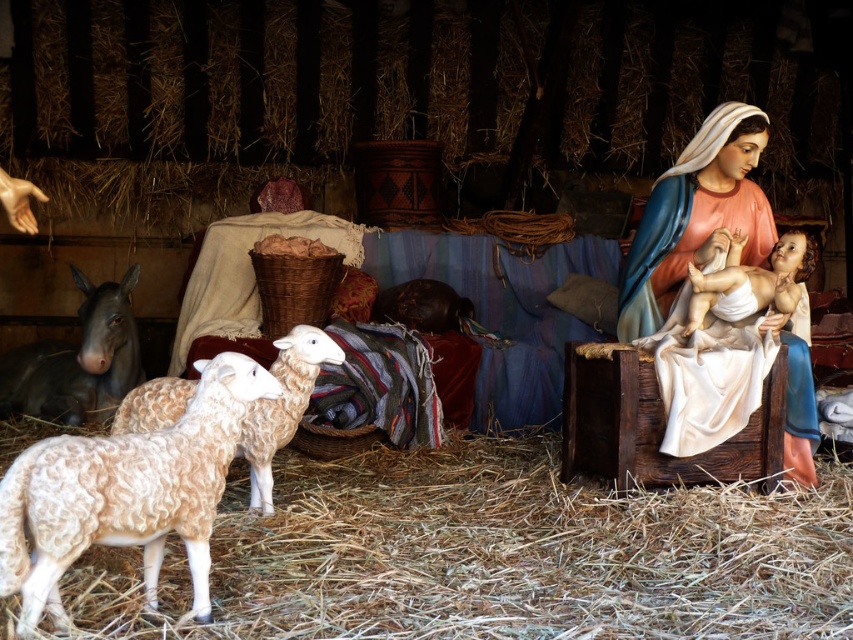
Question: Among these objects, which one is farthest from the camera?

Choices:
 (A) light brown woolen hay at lower center
 (B) matte porcelain statue at right

Answer: (B)

Question: Does matte porcelain statue at right have a smaller size compared to fluffy woolen sheep at center?

Choices:
 (A) no
 (B) yes

Answer: (B)

Question: Which object appears farthest from the camera in this image?

Choices:
 (A) matte porcelain statue at right
 (B) light brown woolen hay at lower center
 (C) fuzzy woolen sheep at lower left

Answer: (A)

Question: Is fuzzy woolen sheep at lower left positioned before fluffy woolen sheep at center?

Choices:
 (A) no
 (B) yes

Answer: (B)

Question: Is the position of matte porcelain statue at right more distant than that of fluffy woolen sheep at center?

Choices:
 (A) no
 (B) yes

Answer: (B)

Question: Among these points, which one is farthest from the camera?

Choices:
 (A) (737, 116)
 (B) (177, 428)

Answer: (A)